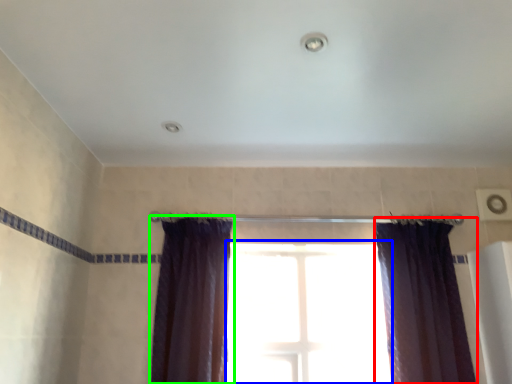
Question: Considering the real-world distances, which object is closest to curtain (highlighted by a red box)? window (highlighted by a blue box) or curtain (highlighted by a green box).

Choices:
 (A) window
 (B) curtain

Answer: (A)